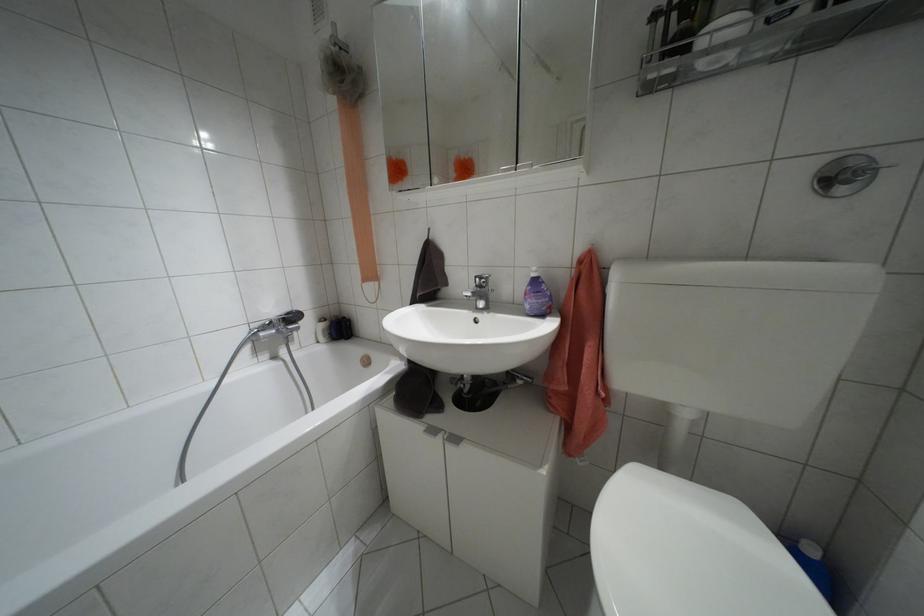
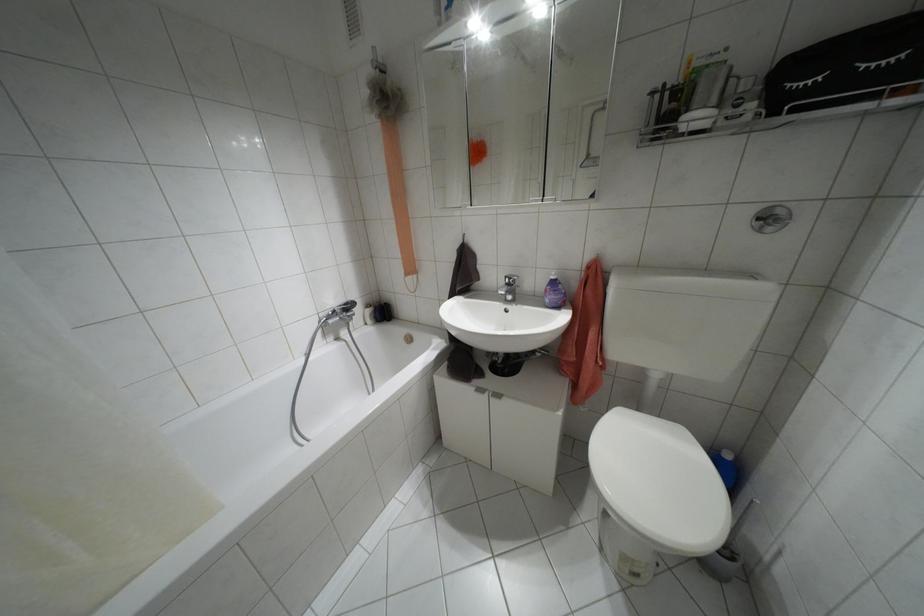
Where in the second image is the point corresponding to point (532, 274) from the first image?

(552, 277)